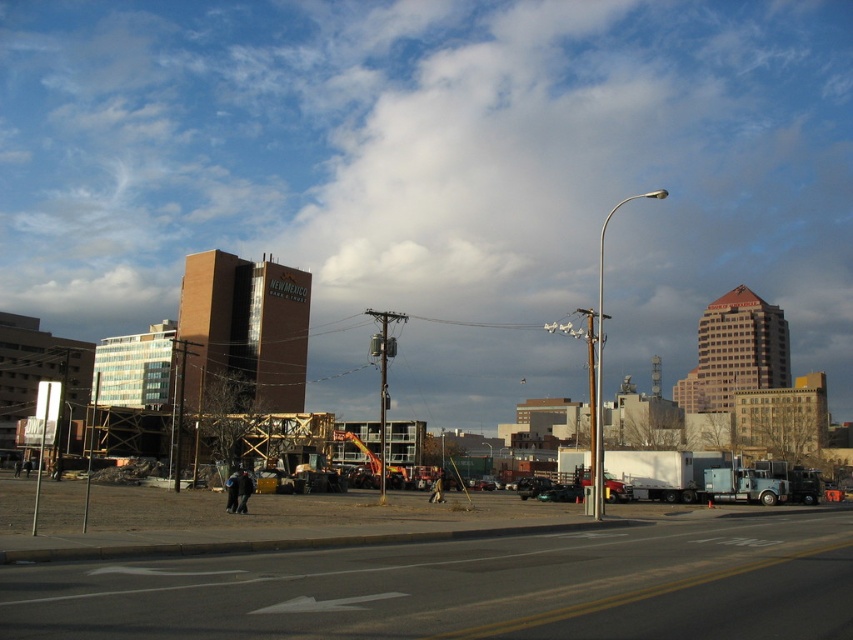
Question: Does green matte car at center lie behind metallic silver truck at center?

Choices:
 (A) no
 (B) yes

Answer: (A)

Question: Which point is farther to the camera?

Choices:
 (A) green matte car at center
 (B) metallic silver truck at center
 (C) brown wooden construction site at center

Answer: (B)

Question: Is brown wooden construction site at center bigger than metallic silver truck at center?

Choices:
 (A) no
 (B) yes

Answer: (B)

Question: Is brown wooden construction site at center to the right of metallic silver truck at center from the viewer's perspective?

Choices:
 (A) yes
 (B) no

Answer: (B)

Question: Which point appears closest to the camera in this image?

Choices:
 (A) (555, 490)
 (B) (700, 554)

Answer: (B)

Question: Which point is closer to the camera?

Choices:
 (A) (556, 484)
 (B) (532, 488)
 (C) (20, 579)

Answer: (C)